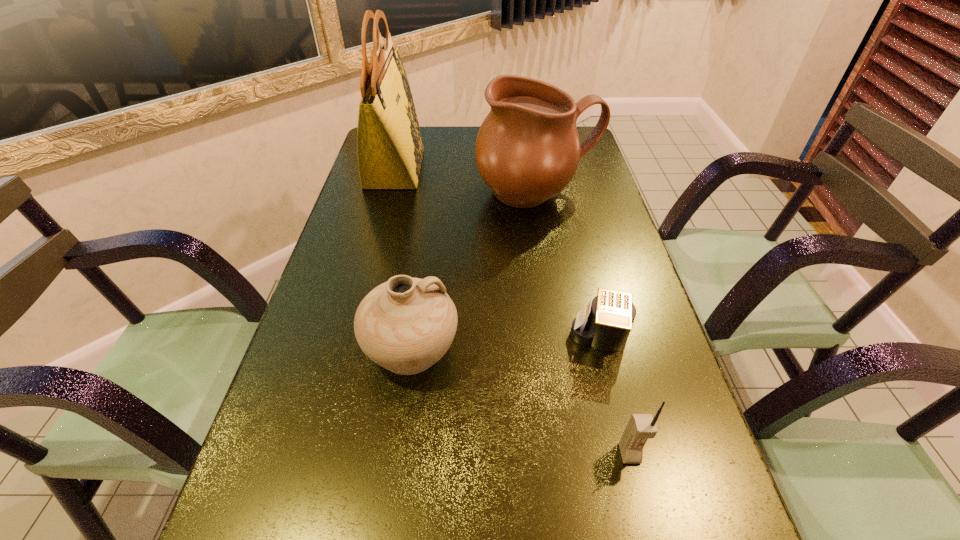
You are a GUI agent. You are given a task and a screenshot of the screen. Output one action in this format:
    pyautogui.click(x=<x>, y=<y>)
    Task: Click on the blank region between the pottery and the tallest object
    The image size is (960, 540).
    Given the screenshot: What is the action you would take?
    pyautogui.click(x=403, y=259)

Locate an element on the screen. vacant space that's between the cream pitcher and the pottery is located at coordinates (474, 272).

Locate an element on the screen. free space between the tote bag and the cellular telephone is located at coordinates (512, 311).

The image size is (960, 540). Find the location of `the third closest object relative to the calculator`. the third closest object relative to the calculator is located at coordinates (527, 150).

What are the coordinates of `the second closest object to the cellular telephone` in the screenshot? It's located at (405, 325).

Locate an element on the screen. This screenshot has height=540, width=960. free point that satisfies the following two spatial constraints: 1. on the front-facing side of the pottery; 2. on the right side of the tote bag is located at coordinates (347, 349).

Locate an element on the screen. Image resolution: width=960 pixels, height=540 pixels. blank area in the image that satisfies the following two spatial constraints: 1. on the front-facing side of the pottery; 2. on the right side of the tallest object is located at coordinates (347, 349).

Where is `free region that satisfies the following two spatial constraints: 1. on the front-facing side of the pottery; 2. on the left side of the tallest object`? The image size is (960, 540). free region that satisfies the following two spatial constraints: 1. on the front-facing side of the pottery; 2. on the left side of the tallest object is located at coordinates (347, 349).